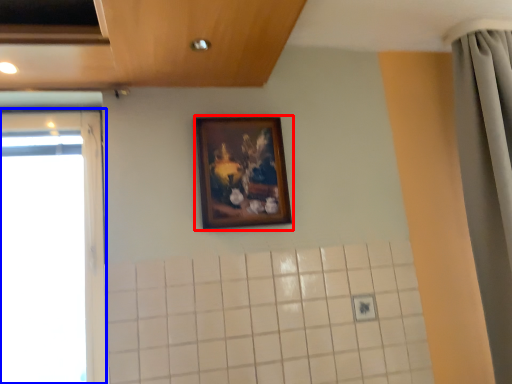
Question: Which of the following is the closest to the observer, picture frame (highlighted by a red box) or window (highlighted by a blue box)?

Choices:
 (A) picture frame
 (B) window

Answer: (B)